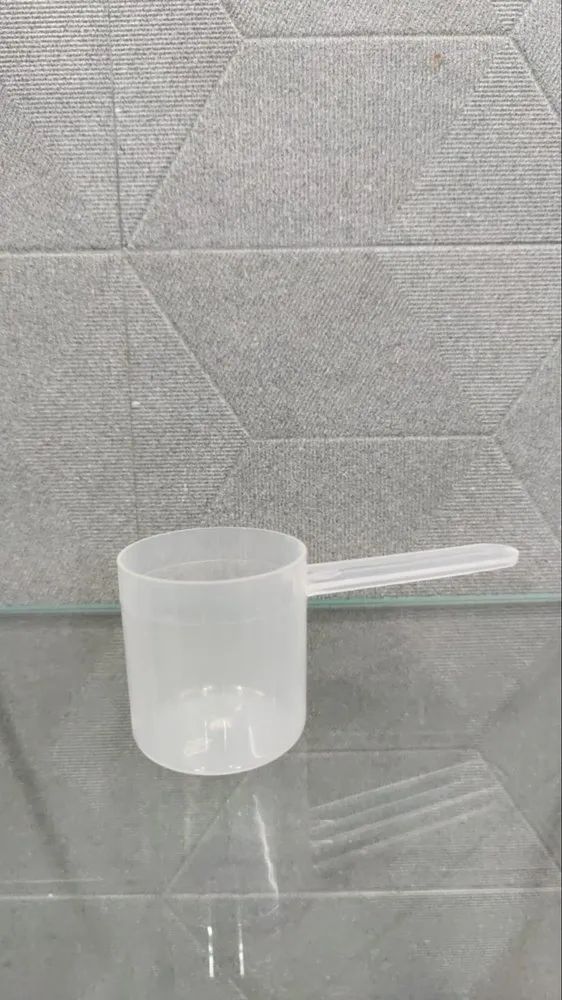
Where is `plastic measuring cup`? This screenshot has width=562, height=1000. plastic measuring cup is located at coordinates (238, 609).